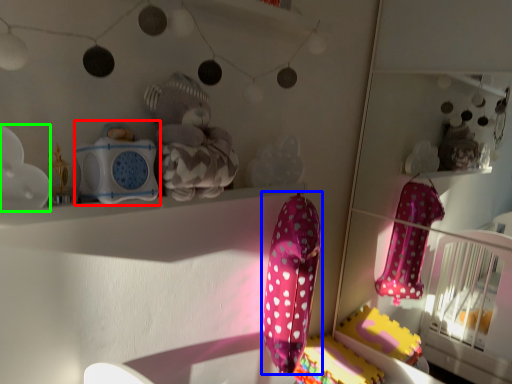
Question: Based on their relative distances, which object is nearer to toy (highlighted by a red box)? Choose from baby clothe (highlighted by a blue box) and toy (highlighted by a green box).

Choices:
 (A) baby clothe
 (B) toy

Answer: (B)